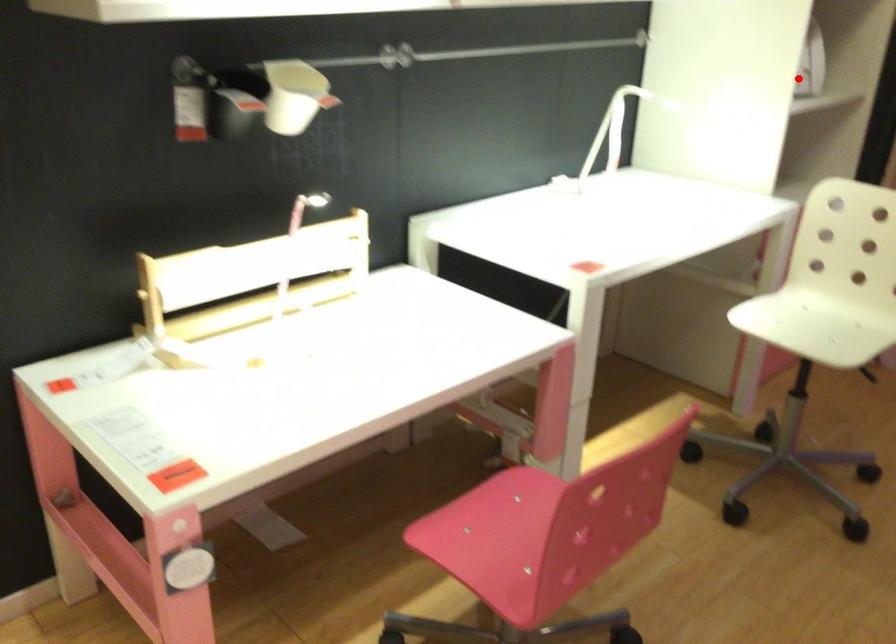
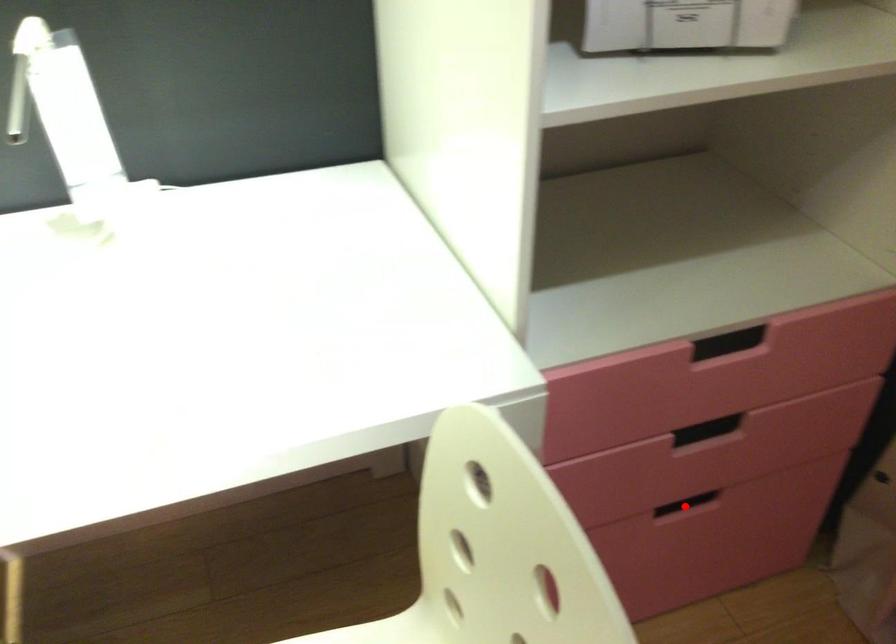
I am providing you with two images of the same scene from different viewpoints. A red point is marked on the first image and another point is marked on the second image. Is the red point in image1 aligned with the point shown in image2?

No